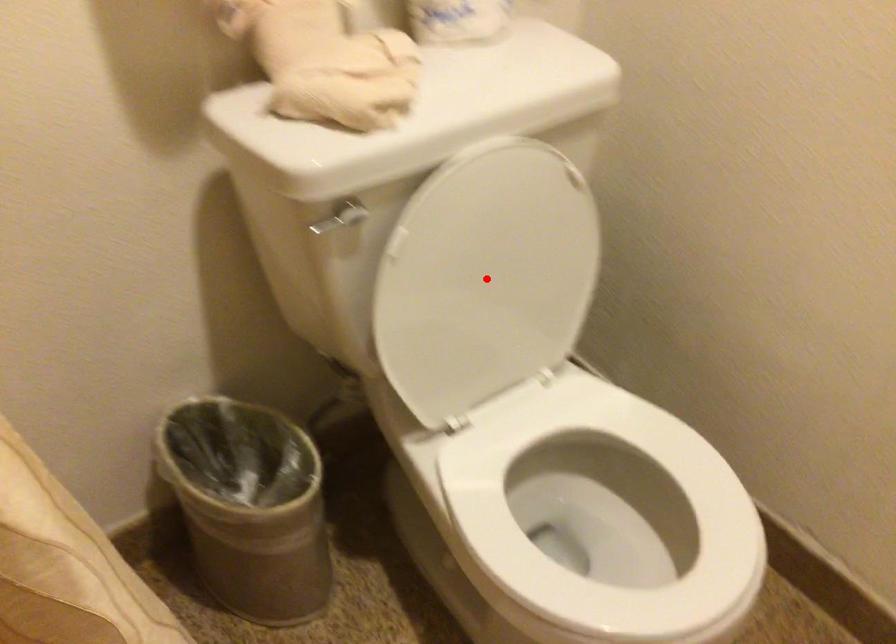
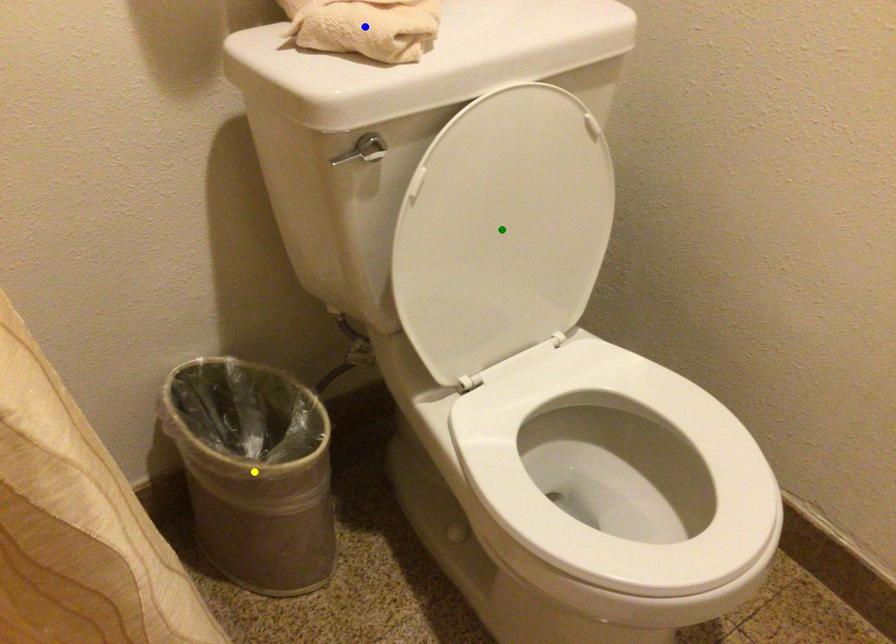
Question: I am providing you with two images of the same scene from different viewpoints. A red point is marked on the first image. You are given multiple points on the second image. Which spot in image 2 lines up with the point in image 1?

Choices:
 (A) yellow point
 (B) blue point
 (C) green point

Answer: (C)